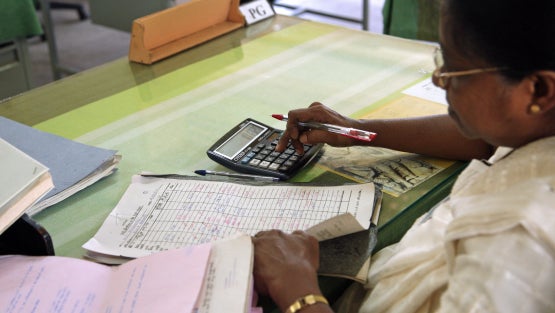
Image resolution: width=555 pixels, height=313 pixels. Find the location of `blue folder`. blue folder is located at coordinates (83, 166).